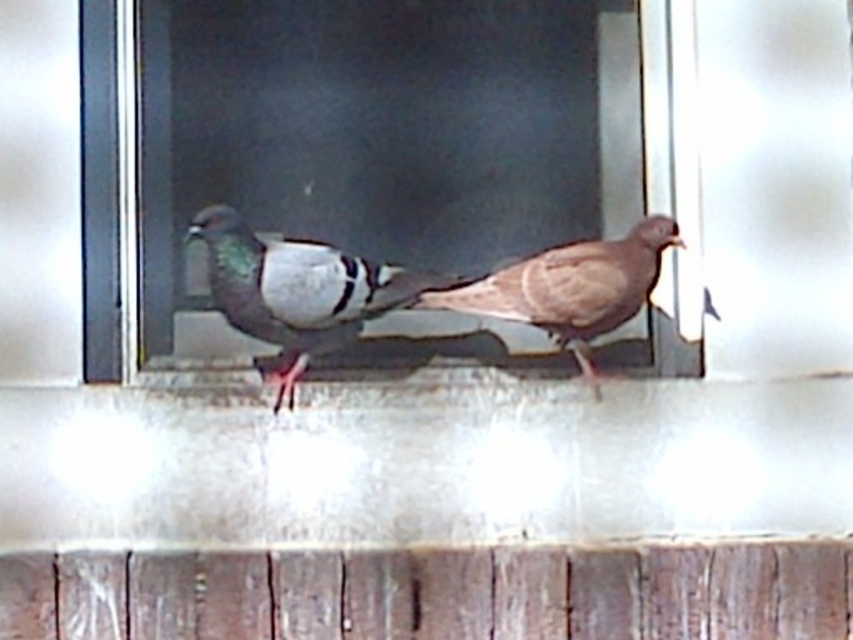
Does clear glass window at center have a smaller size compared to speckled feathered pigeon at center?

No.

Who is more distant from viewer, (384, 3) or (344, 278)?

The point (384, 3) is more distant.

The width and height of the screenshot is (853, 640). I want to click on clear glass window at center, so pos(341,144).

Is speckled feathered pigeon at center below brown feathered pigeon at center?

No, speckled feathered pigeon at center is not below brown feathered pigeon at center.

Is point (207, 212) farther from camera compared to point (634, 230)?

No, it is in front of (634, 230).

Is point (260, 308) behind point (450, 296)?

No, (260, 308) is closer to viewer.

Find the location of a particular element. This screenshot has width=853, height=640. speckled feathered pigeon at center is located at coordinates (299, 291).

Can you confirm if clear glass window at center is positioned to the left of brown feathered pigeon at center?

Yes, clear glass window at center is to the left of brown feathered pigeon at center.

Which is below, clear glass window at center or brown feathered pigeon at center?

brown feathered pigeon at center

Does point (621, 92) come closer to viewer compared to point (483, 292)?

That is False.

In order to click on clear glass window at center in this screenshot , I will do `click(341, 144)`.